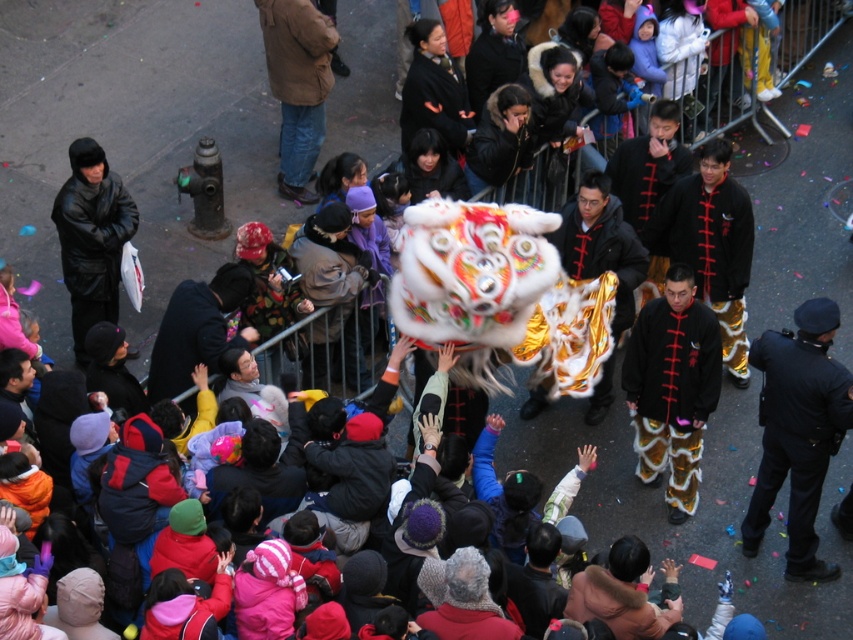
Is black uniform at right above brown leather jacket at upper center?

Incorrect, black uniform at right is not positioned above brown leather jacket at upper center.

Where is `black uniform at right`? The image size is (853, 640). black uniform at right is located at coordinates (798, 432).

Based on the photo, is black uniform at right to the left of black leather jacket at upper left from the viewer's perspective?

In fact, black uniform at right is to the right of black leather jacket at upper left.

Can you confirm if black uniform at right is positioned above black leather jacket at upper left?

Actually, black uniform at right is below black leather jacket at upper left.

Where is `black uniform at right`? Image resolution: width=853 pixels, height=640 pixels. black uniform at right is located at coordinates (798, 432).

Who is shorter, black satin jacket at center or black leather jacket at upper left?

black leather jacket at upper left

Does black satin jacket at center have a larger size compared to black leather jacket at upper left?

Yes, black satin jacket at center is bigger than black leather jacket at upper left.

Is point (637, 445) positioned behind point (128, 220)?

No, (637, 445) is in front of (128, 220).

This screenshot has height=640, width=853. I want to click on black satin jacket at center, so (672, 387).